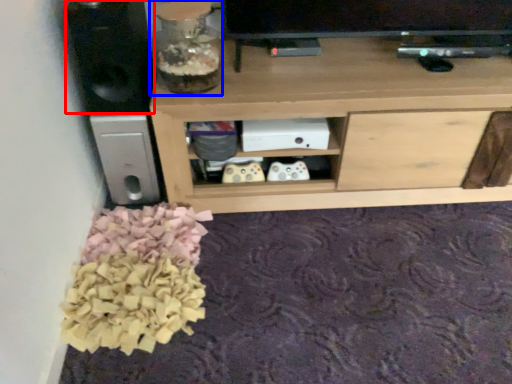
Question: Which point is further to the camera, speaker (highlighted by a red box) or glass vase (highlighted by a blue box)?

Choices:
 (A) speaker
 (B) glass vase

Answer: (B)